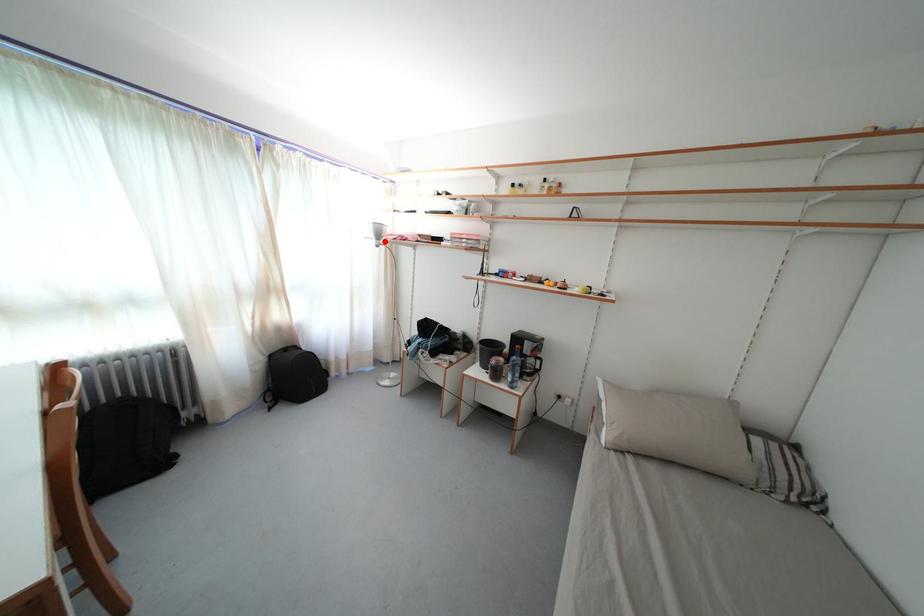
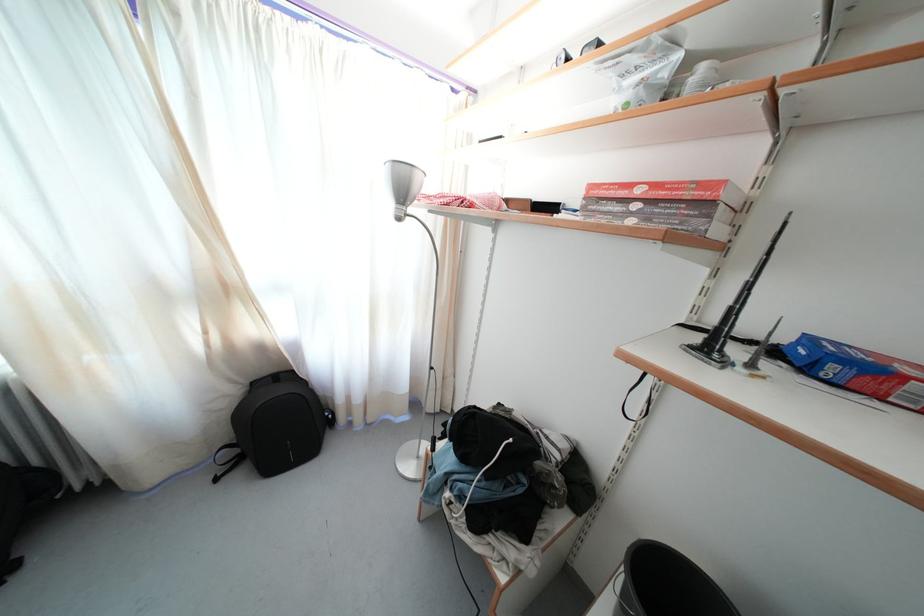
The point at the highlighted location is marked in the first image. Where is the corresponding point in the second image?

(408, 199)